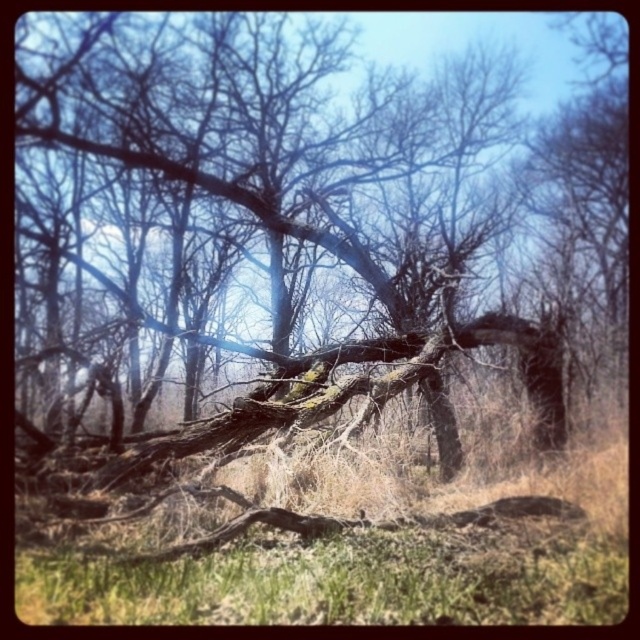
Measure the distance from brown textured log at center to green grass at center.

brown textured log at center and green grass at center are 9.49 meters apart.

Between brown textured log at center and green grass at center, which one has more height?

brown textured log at center

Find the location of a particular element. The image size is (640, 640). brown textured log at center is located at coordinates (314, 216).